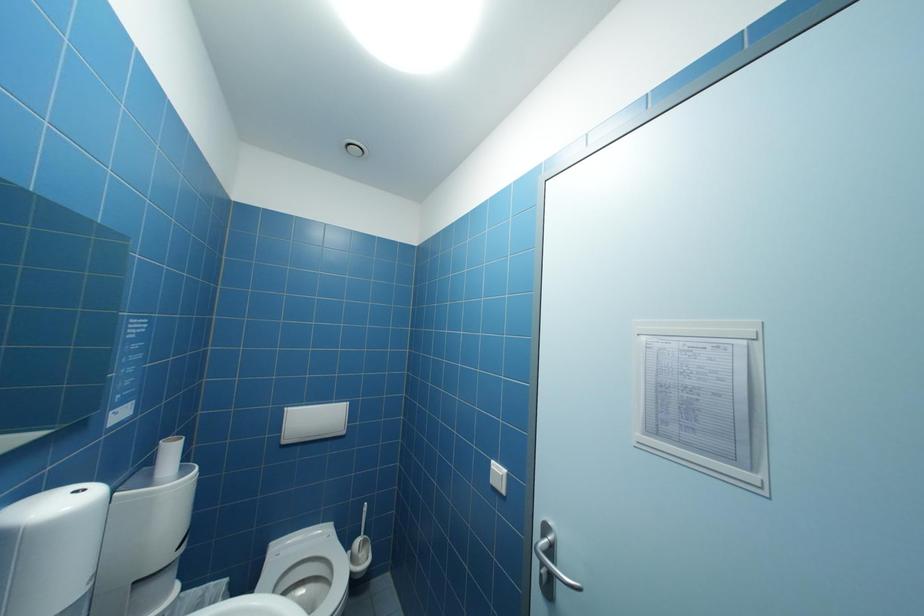
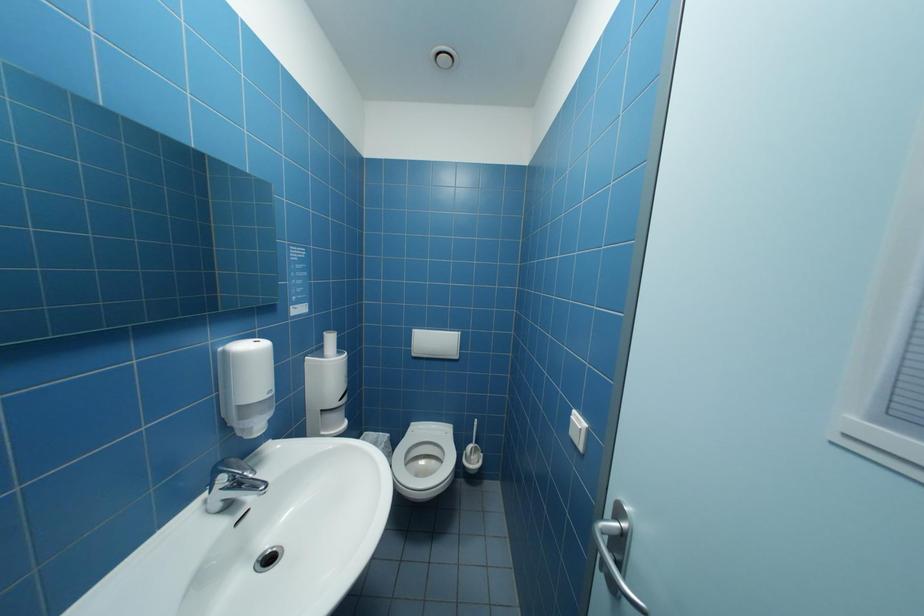
Question: The camera is either moving clockwise (left) or counter-clockwise (right) around the object. The first image is from the beginning of the video and the second image is from the end. Is the camera moving left or right when shooting the video?

Choices:
 (A) Left
 (B) Right

Answer: (B)